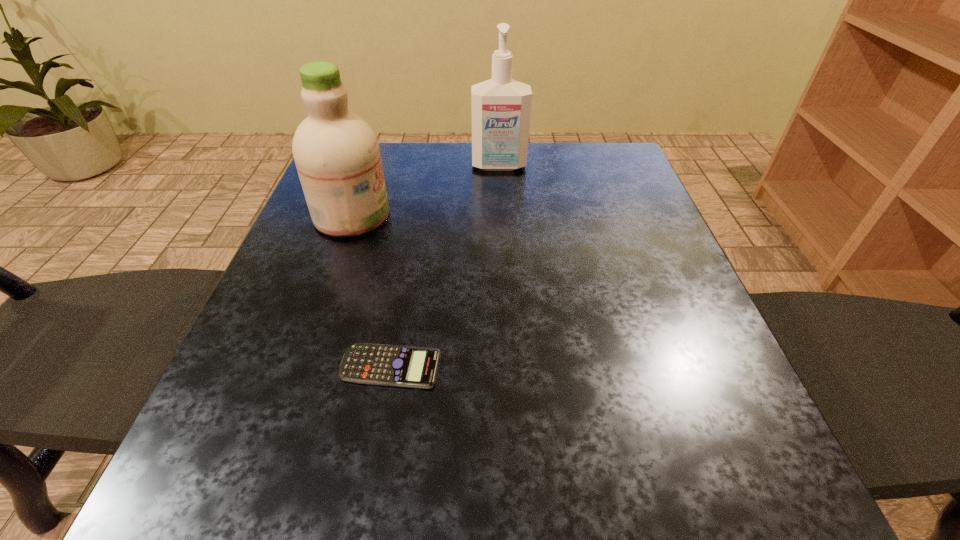
Locate an element on the screen. The height and width of the screenshot is (540, 960). object at the left edge is located at coordinates (336, 152).

This screenshot has height=540, width=960. I want to click on vacant area at the far edge of the desktop, so click(x=449, y=191).

Locate an element on the screen. This screenshot has width=960, height=540. vacant region at the near edge of the desktop is located at coordinates (628, 485).

The height and width of the screenshot is (540, 960). Identify the location of free space at the left edge of the desktop. (312, 285).

You are a GUI agent. You are given a task and a screenshot of the screen. Output one action in this format:
    pyautogui.click(x=<x>, y=<y>)
    Task: Click on the free space at the right edge of the desktop
    
    Given the screenshot: What is the action you would take?
    pyautogui.click(x=656, y=261)

Locate an element on the screen. The height and width of the screenshot is (540, 960). vacant region at the near left corner is located at coordinates (159, 513).

Locate an element on the screen. The height and width of the screenshot is (540, 960). blank area at the far right corner is located at coordinates (609, 153).

At what (x,y) coordinates should I click in order to perform the action: click on unoccupied area between the second farthest object and the nearest object. Please return your answer as a coordinate pair (x, y). Looking at the image, I should click on (371, 291).

Image resolution: width=960 pixels, height=540 pixels. I want to click on vacant area that lies between the rightmost object and the nearer cleansing agent, so click(x=425, y=191).

Where is `vacant region between the nearer cleansing agent and the right cleansing agent`? Image resolution: width=960 pixels, height=540 pixels. vacant region between the nearer cleansing agent and the right cleansing agent is located at coordinates [425, 191].